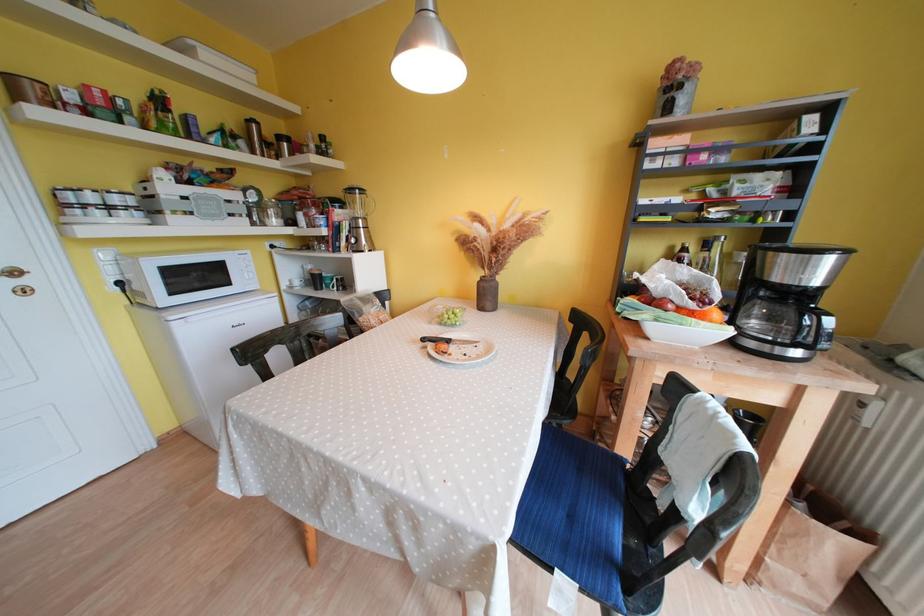
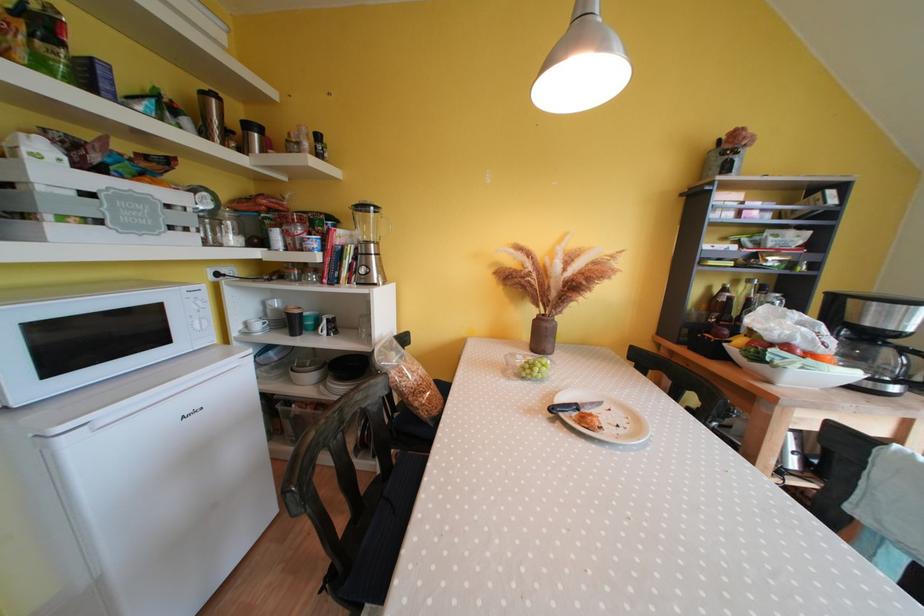
Where in the second image is the point corresponding to point 354,240 from the first image?

(357, 269)